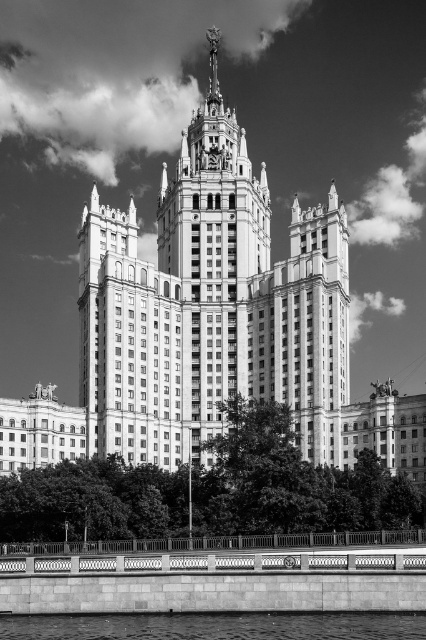
From the picture: Is smooth concrete tower at center wider than smooth concrete river at lower center?

Indeed, smooth concrete tower at center has a greater width compared to smooth concrete river at lower center.

Between smooth concrete tower at center and smooth concrete river at lower center, which one is positioned lower?

smooth concrete river at lower center is below.

Is point (132, 452) closer to viewer compared to point (417, 636)?

No.

You are a GUI agent. You are given a task and a screenshot of the screen. Output one action in this format:
    pyautogui.click(x=<x>, y=<y>)
    Task: Click on the smooth concrete tower at center
    
    Given the screenshot: What is the action you would take?
    pyautogui.click(x=210, y=307)

Which is below, white stone tower at center or smooth concrete river at lower center?

smooth concrete river at lower center

Between point (224, 134) and point (356, 636), which one is positioned in front?

Point (356, 636) is more forward.

This screenshot has width=426, height=640. Identify the location of white stone tower at center. (213, 202).

Who is more forward, (155, 358) or (210, 244)?

Point (155, 358) is in front.

This screenshot has width=426, height=640. What do you see at coordinates (210, 307) in the screenshot? I see `smooth concrete tower at center` at bounding box center [210, 307].

Where is `smooth concrete tower at center`? This screenshot has height=640, width=426. smooth concrete tower at center is located at coordinates (210, 307).